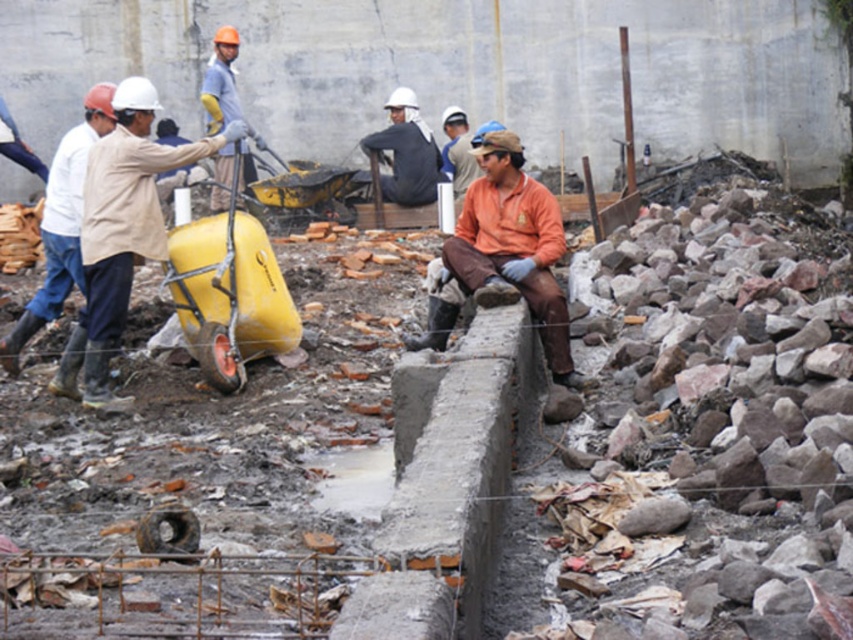
Question: Can you confirm if matte yellow wheelbarrow at left is positioned below dark gray fabric shirt at center?

Choices:
 (A) yes
 (B) no

Answer: (A)

Question: Among these points, which one is nearest to the camera?

Choices:
 (A) (76, 227)
 (B) (195, 356)

Answer: (A)

Question: Based on their relative distances, which object is nearer to the matte gray shirt at upper center?

Choices:
 (A) dark gray fabric shirt at center
 (B) orange fabric shirt at center

Answer: (A)

Question: Which point is farther to the camera?

Choices:
 (A) (128, 404)
 (B) (486, 289)

Answer: (A)

Question: Does orange fabric shirt at center appear on the left side of white matte helmet at left?

Choices:
 (A) no
 (B) yes

Answer: (A)

Question: Is yellow plastic wheelbarrow at left to the left of matte gray shirt at upper center from the viewer's perspective?

Choices:
 (A) no
 (B) yes

Answer: (A)